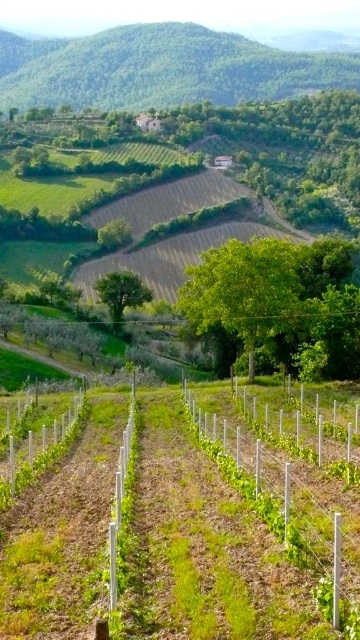
Question: Is green leafy hillside at upper center to the left of green grassy row at center from the viewer's perspective?

Choices:
 (A) yes
 (B) no

Answer: (A)

Question: Can you confirm if green leafy hillside at upper center is positioned below green grassy row at center?

Choices:
 (A) yes
 (B) no

Answer: (B)

Question: Is green leafy hillside at upper center wider than green grassy row at center?

Choices:
 (A) yes
 (B) no

Answer: (A)

Question: Which object is closer to the camera taking this photo?

Choices:
 (A) green leafy hillside at upper center
 (B) green grassy row at center

Answer: (B)